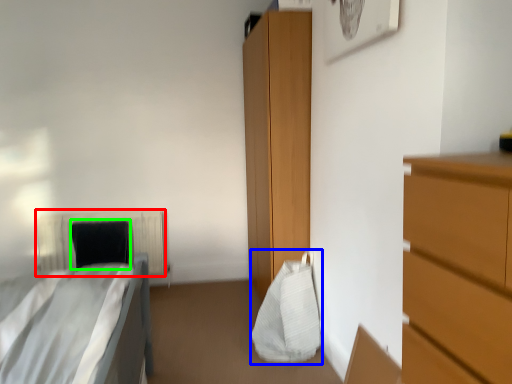
Question: Which object is positioned farthest from radiator (highlighted by a red box)? Select from bag (highlighted by a blue box) and pillow (highlighted by a green box).

Choices:
 (A) bag
 (B) pillow

Answer: (A)